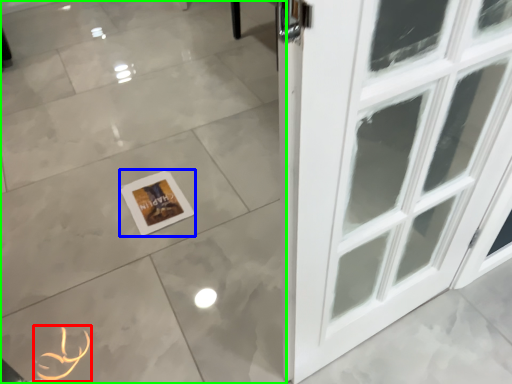
Question: Considering the real-world distances, which object is farthest from print (highlighted by a red box)? picture frame (highlighted by a blue box) or ceramic tile (highlighted by a green box)?

Choices:
 (A) picture frame
 (B) ceramic tile

Answer: (B)